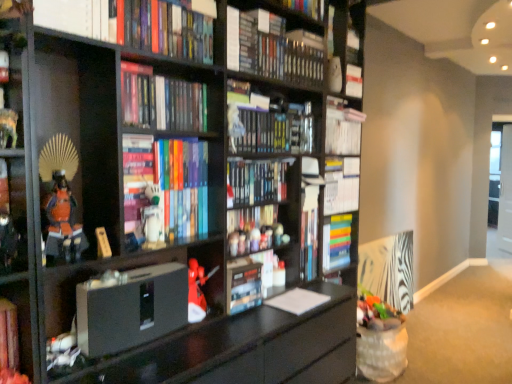
Question: Is multicolored hardcover book at center, which ranks as the second book in bottom-to-top order, taller or shorter than matte plastic toy at center, the 3th toy positioned from the right?

Choices:
 (A) short
 (B) tall

Answer: (B)

Question: Considering the relative positions of multicolored hardcover book at center, which ranks as the second book in bottom-to-top order, and matte plastic toy at center, the third toy ordered from the bottom, in the image provided, is multicolored hardcover book at center, which ranks as the second book in bottom-to-top order, to the left or to the right of matte plastic toy at center, the third toy ordered from the bottom,?

Choices:
 (A) right
 (B) left

Answer: (A)

Question: Which is nearer to the matte black samurai armor at left, which ranks as the 1th shelf in bottom-to-top order?

Choices:
 (A) white matte book at upper center, which ranks as the first book in top-to-bottom order
 (B) hardcover book at upper center, the seventh book positioned from the bottom
 (C) matte plastic toy at center, which is the 3th toy in top-to-bottom order
 (D) matte plastic toy at center, the second toy in the bottom-to-top sequence
 (E) hardcover book at center, marked as the 6th book in a top-to-bottom arrangement

Answer: (B)

Question: Estimate the real-world distances between objects in this image. Which object is farther from the matte black samurai armor at left, which ranks as the 1th shelf in bottom-to-top order?

Choices:
 (A) hardcover book at center, positioned as the 2th paperback book in right-to-left order
 (B) matte plastic toy at center, placed as the fourth toy when sorted from left to right
 (C) hardcover books at center, the 2th book positioned from the top
 (D) white matte figurine at center, acting as the 5th toy starting from the back
 (E) hardcover book at upper center, the seventh book positioned from the bottom

Answer: (C)